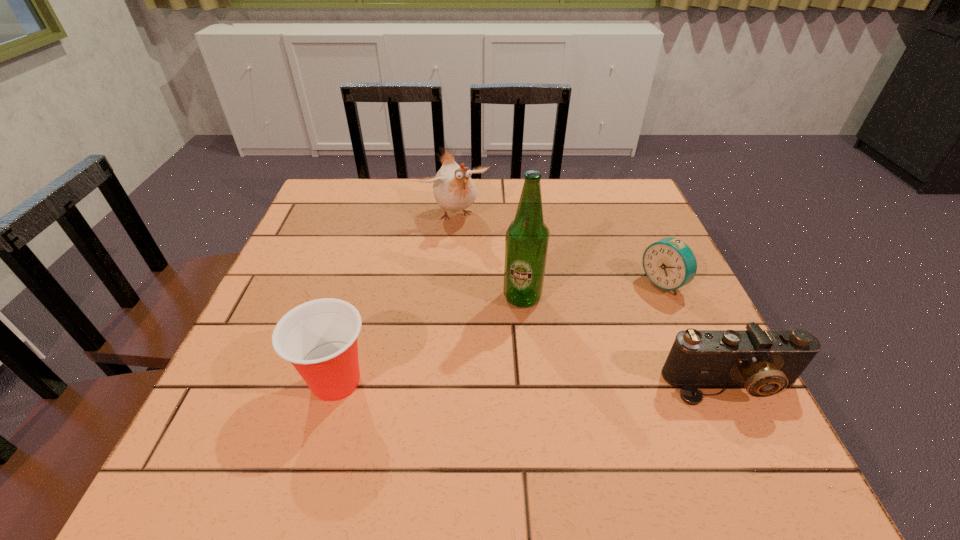
This screenshot has height=540, width=960. Find the location of `free area in between the tallest object and the third tallest object`. free area in between the tallest object and the third tallest object is located at coordinates (429, 339).

I want to click on free point between the bird and the camera, so click(592, 300).

Image resolution: width=960 pixels, height=540 pixels. I want to click on free space between the third tallest object and the tallest object, so click(429, 339).

Image resolution: width=960 pixels, height=540 pixels. I want to click on object that stands as the closest to the camera, so click(x=669, y=263).

Locate an element on the screen. The width and height of the screenshot is (960, 540). object that is the third nearest to the camera is located at coordinates (454, 190).

Locate an element on the screen. This screenshot has width=960, height=540. vacant space that satisfies the following two spatial constraints: 1. on the back side of the beer bottle; 2. on the right side of the leftmost object is located at coordinates (360, 297).